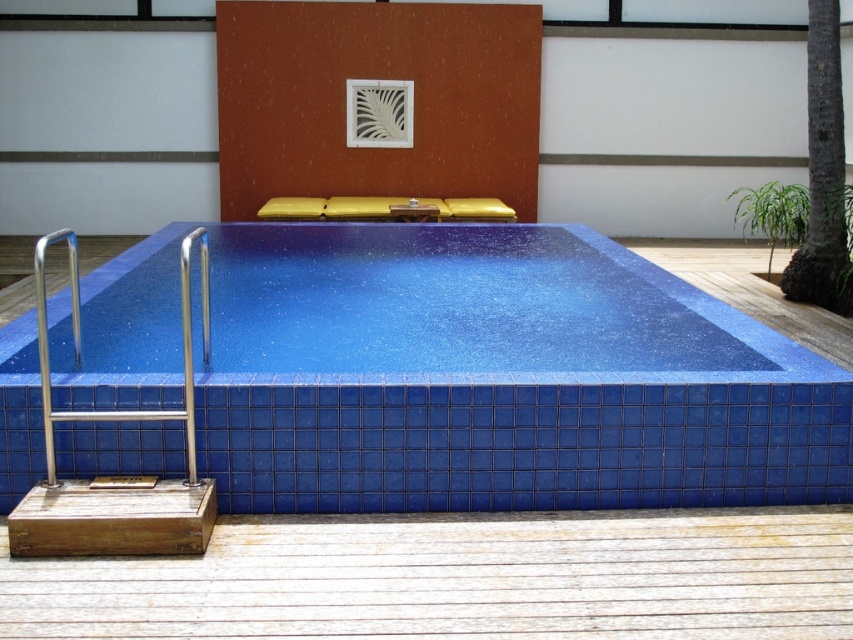
You are standing at the edge of the pool and want to locate two points marked in the image. The first point is at coordinate point [786,212] and the second is at point [184,388]. Which point is closer to your current position?

Point [184,388] is closer to your current position because it is nearer to the camera compared to point [786,212] which is further away.

You are planning to install a new palm tree in the garden adjacent to the pool. Given the current setup, which object in the image is taller between the green leafy palm tree at upper right and the satin stainless steel handrail at lower left?

The green leafy palm tree at upper right is not as tall as the satin stainless steel handrail at lower left, so the handrail is taller.

You are standing on the deck and want to enter the blue glossy tile swimming pool at lower left. The satin stainless steel handrail at lower left is in your path. Can you walk directly to the pool without going around the handrail?

The blue glossy tile swimming pool at lower left is closer to you than the satin stainless steel handrail at lower left, so you can walk directly to the pool without needing to go around the handrail.